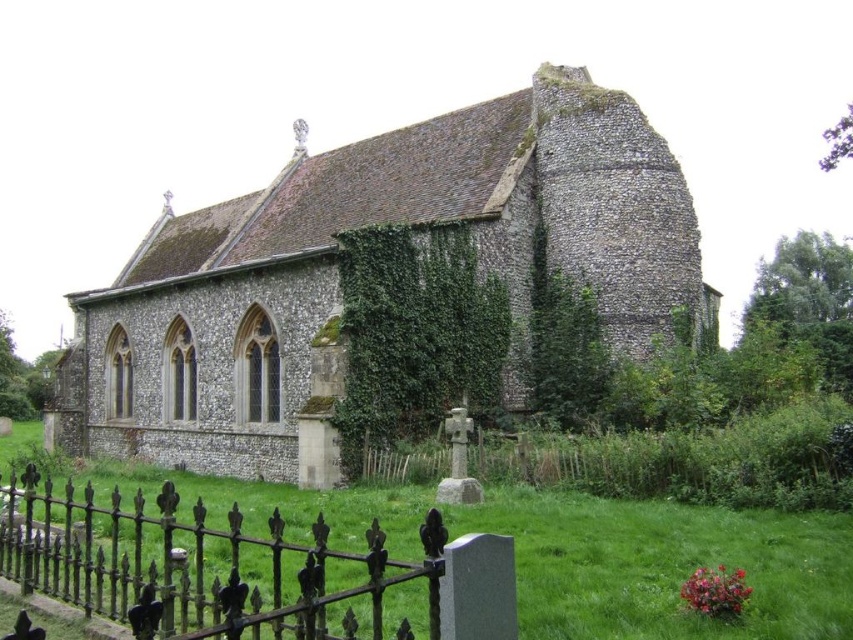
Question: Is rusty iron fence at lower left thinner than green leafy ivy at center?

Choices:
 (A) no
 (B) yes

Answer: (A)

Question: Does rusty iron fence at lower left come behind green leafy ivy at center?

Choices:
 (A) yes
 (B) no

Answer: (B)

Question: Does rusty iron fence at lower left appear on the left side of green leafy ivy at center?

Choices:
 (A) no
 (B) yes

Answer: (B)

Question: Considering the real-world distances, which object is farthest from the green leafy ivy at center?

Choices:
 (A) stone church at center
 (B) rusty iron fence at lower left

Answer: (B)

Question: Considering the real-world distances, which object is farthest from the stone church at center?

Choices:
 (A) rusty iron fence at lower left
 (B) green leafy ivy at center

Answer: (A)

Question: Which object is positioned closest to the green leafy ivy at center?

Choices:
 (A) rusty iron fence at lower left
 (B) stone church at center

Answer: (B)